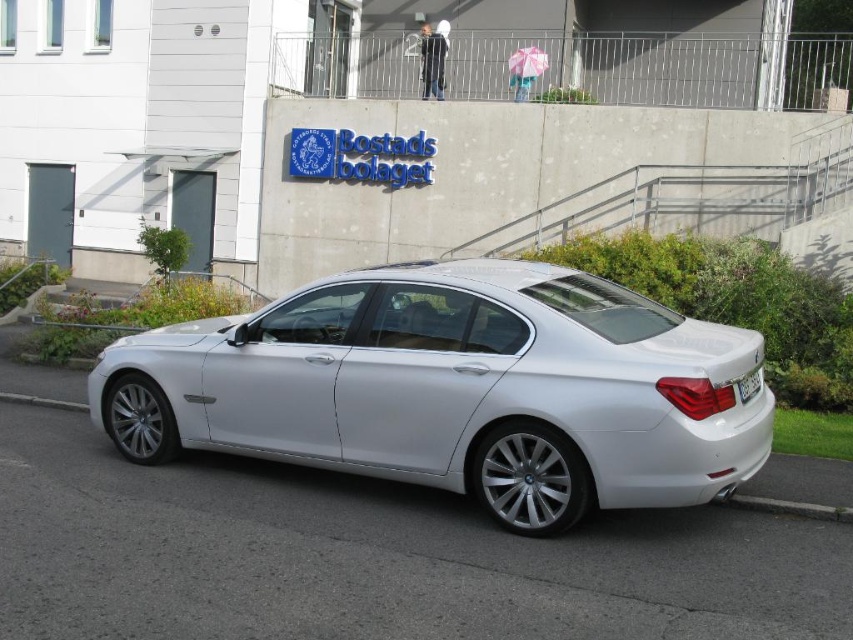
Question: Does sleek silver sedan at center have a lesser width compared to gray concrete curb at lower right?

Choices:
 (A) yes
 (B) no

Answer: (B)

Question: Which point is closer to the camera?

Choices:
 (A) (811, 516)
 (B) (740, 388)

Answer: (B)

Question: Which of these objects is positioned closest to the white plastic license plate at rear?

Choices:
 (A) sleek silver sedan at center
 (B) gray concrete curb at lower right

Answer: (B)

Question: Which point is farther to the camera?

Choices:
 (A) (415, 273)
 (B) (846, 509)
 (C) (740, 387)

Answer: (A)

Question: From the image, what is the correct spatial relationship of sleek silver sedan at center in relation to white plastic license plate at rear?

Choices:
 (A) below
 (B) above

Answer: (B)

Question: Is gray concrete curb at lower right behind white plastic license plate at rear?

Choices:
 (A) yes
 (B) no

Answer: (A)